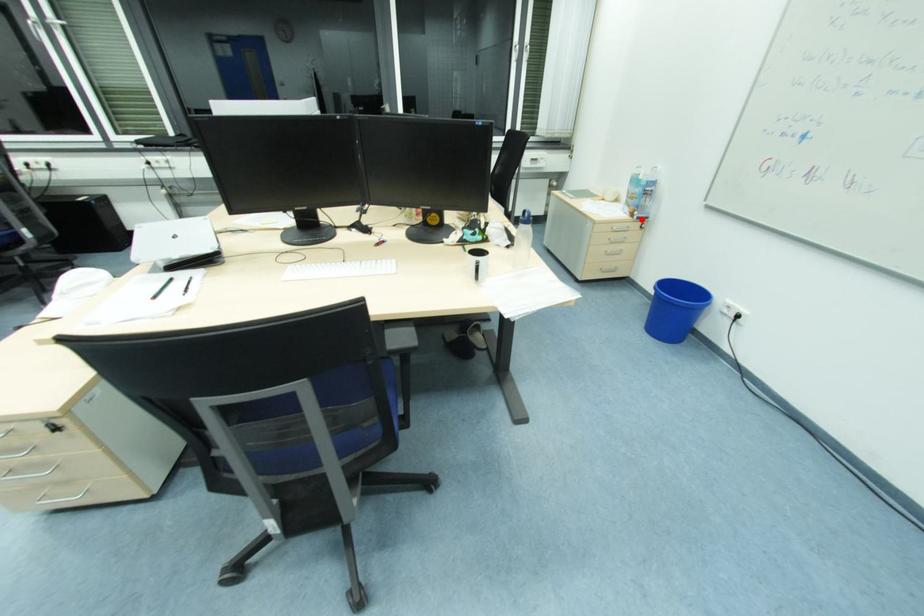
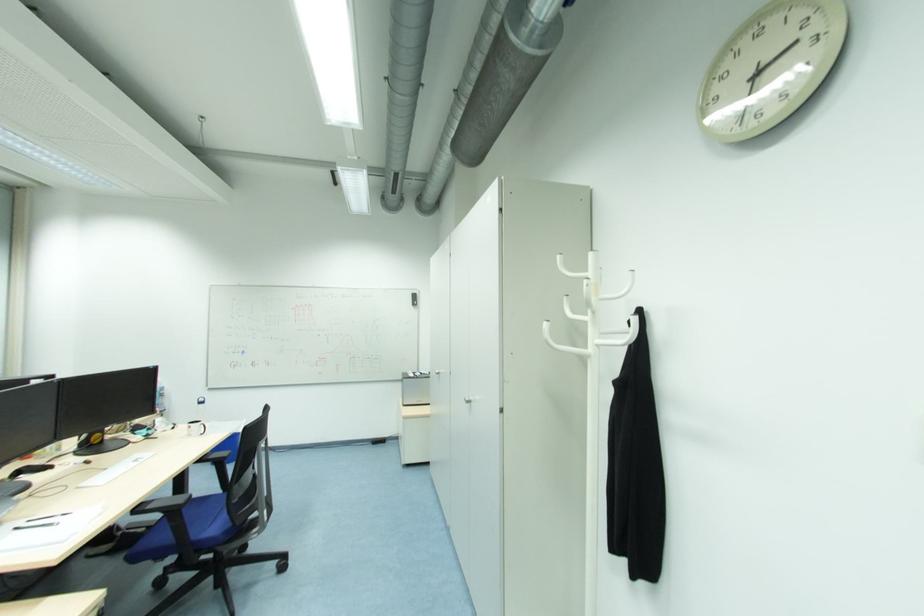
The point at the highlighted location is marked in the first image. Where is the corresponding point in the second image?

(164, 413)